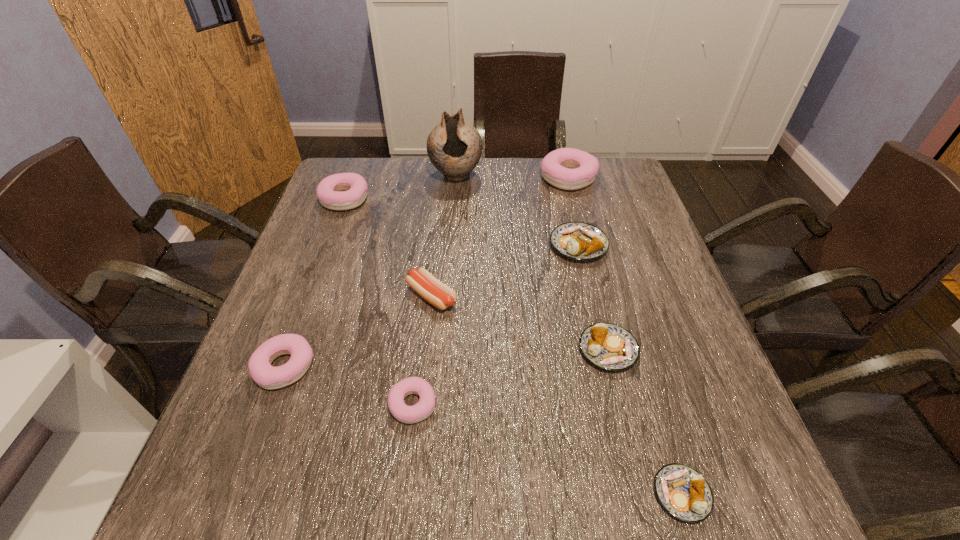
Where is `free space at the left edge`? This screenshot has height=540, width=960. free space at the left edge is located at coordinates (302, 254).

At what (x,y) coordinates should I click in order to perform the action: click on free space at the right edge of the desktop. Please return your answer as a coordinate pair (x, y). Looking at the image, I should click on (686, 428).

The height and width of the screenshot is (540, 960). Identify the location of vacant point at the near left corner. [x=262, y=469].

The width and height of the screenshot is (960, 540). I want to click on vacant space at the far right corner, so click(606, 179).

Image resolution: width=960 pixels, height=540 pixels. What are the coordinates of `vacant space that's between the second biggest pink pastry and the smallest pink pastry` in the screenshot? It's located at (378, 301).

At what (x,y) coordinates should I click in order to perform the action: click on free area in between the third biggest pink pastry and the second biggest pink pastry. Please return your answer as a coordinate pair (x, y). Looking at the image, I should click on (315, 283).

This screenshot has height=540, width=960. Find the location of `free spot between the third biggest pink pastry and the second biggest pink pastry`. free spot between the third biggest pink pastry and the second biggest pink pastry is located at coordinates (315, 283).

Locate an element on the screen. This screenshot has width=960, height=540. free space between the second biggest brown pastry and the tallest pastry is located at coordinates (588, 264).

Locate an element on the screen. This screenshot has height=540, width=960. vacant area between the second biggest pink pastry and the pottery is located at coordinates (400, 187).

Locate an element on the screen. The width and height of the screenshot is (960, 540). vacant area between the fifth nearest pastry and the third biggest pink pastry is located at coordinates (432, 306).